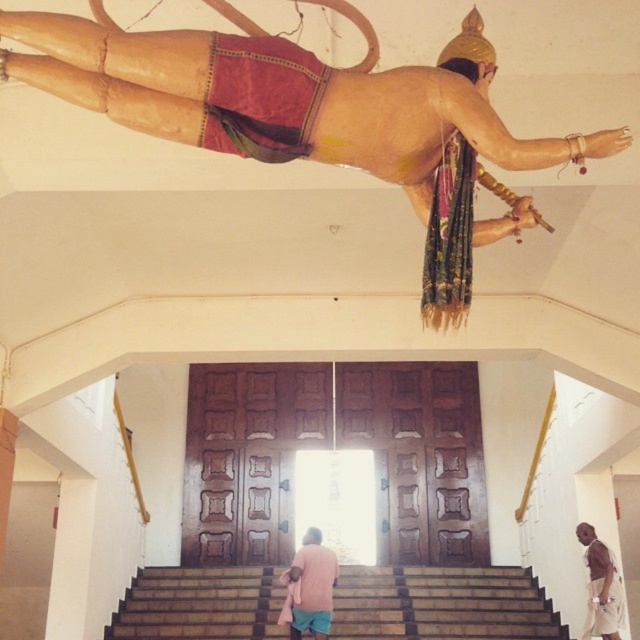
Question: Is brown wooden stairs at center closer to the viewer compared to brown cotton shirt at lower right?

Choices:
 (A) yes
 (B) no

Answer: (B)

Question: Which object is positioned closest to the brown wooden stairs at center?

Choices:
 (A) brown cotton shirt at lower right
 (B) pink fabric at lower center

Answer: (B)

Question: Can you confirm if brown wooden stairs at center is bigger than pink fabric at lower center?

Choices:
 (A) no
 (B) yes

Answer: (A)

Question: Does brown wooden stairs at center have a larger size compared to pink fabric at lower center?

Choices:
 (A) yes
 (B) no

Answer: (B)

Question: Which object is the farthest from the brown cotton shirt at lower right?

Choices:
 (A) pink fabric at lower center
 (B) brown wooden stairs at center

Answer: (B)

Question: Among these objects, which one is nearest to the camera?

Choices:
 (A) brown wooden stairs at center
 (B) brown cotton shirt at lower right

Answer: (B)